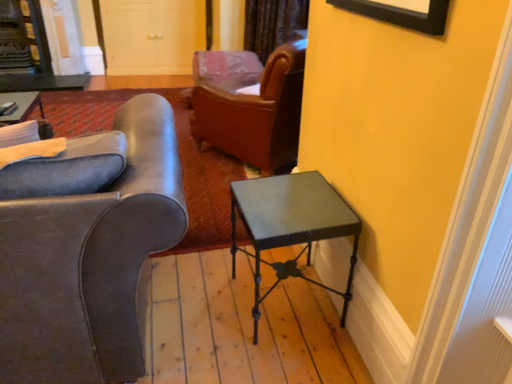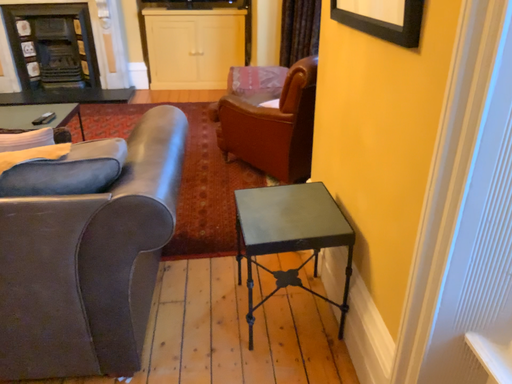
Question: Which way did the camera rotate in the video?

Choices:
 (A) rotated right
 (B) rotated left

Answer: (B)